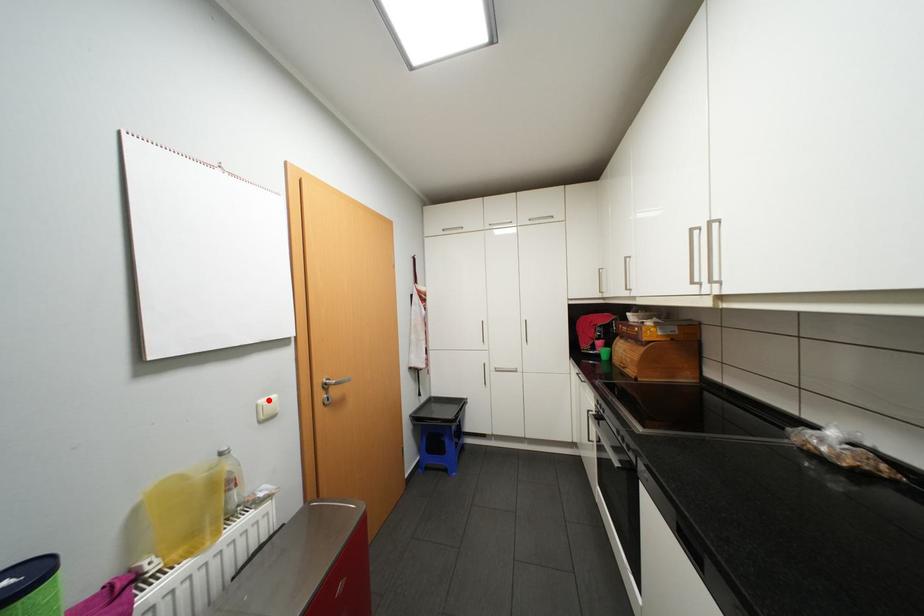
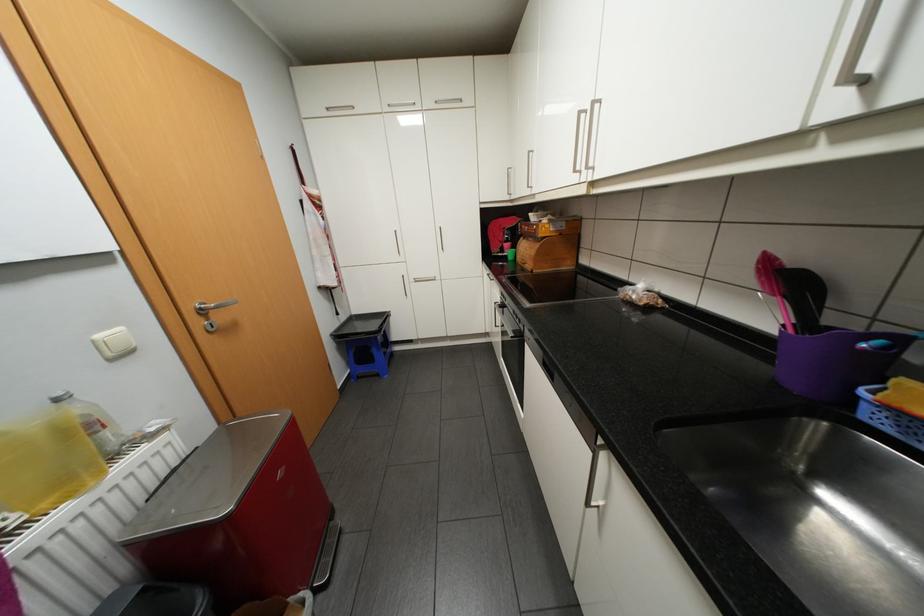
Find the pixel in the second image that matches the highlighted location in the first image.

(106, 334)